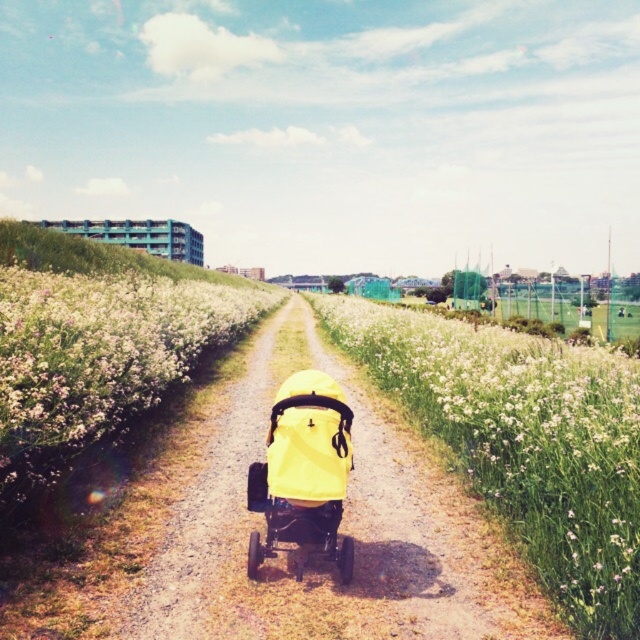
You are walking along the dirt path in the image and want to reach the stroller with a bright yellow canopy in the center. There are two points marked on the path at coordinates point (60, 332) and point (275, 476). Which point should you step on first to ensure you are moving towards the stroller?

You should step on point (275, 476) first because point (60, 332) is behind it, meaning point (275, 476) is closer to your current position and moving towards the stroller requires starting from the closer point.

You are standing at the stroller with a bright yellow canopy in the center of the dirt path. Looking towards the left, you see a point marked at coordinates (99,356). What object is located at that point?

The point at (99,356) corresponds to a white fluffy flower at left.